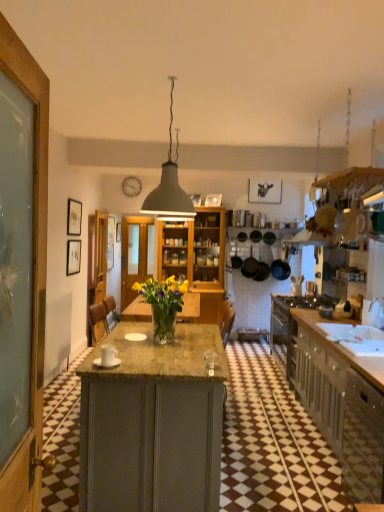
Question: Is wooden picture frame at center, arranged as the 1th picture frame when viewed from the back, inside the boundaries of matte gray lampshade at center, or outside?

Choices:
 (A) outside
 (B) inside

Answer: (A)

Question: Is wooden picture frame at center, the 3th picture frame viewed from the front, in front of or behind matte gray lampshade at center in the image?

Choices:
 (A) front
 (B) behind

Answer: (B)

Question: Which object is positioned farthest from the matte gray cabinetry at right?

Choices:
 (A) black cast iron pan at center, which is the first kitchen appliance from right to left
 (B) matte black frying pan at center, acting as the third kitchen appliance starting from the right
 (C) translucent glass vase at center
 (D) wooden picture frame at center, arranged as the 1th picture frame when viewed from the back
 (E) metallic wall clock at upper center

Answer: (E)

Question: Considering the real-world distances, which object is farthest from the translucent glass vase at center?

Choices:
 (A) matte gray cabinetry at right
 (B) matte black frying pan at center, arranged as the first kitchen appliance when viewed from the left
 (C) wooden picture frame at center, arranged as the 1th picture frame when viewed from the back
 (D) black cast iron pan at center, which is the first kitchen appliance from right to left
 (E) matte black picture frame at left, the second picture frame when ordered from front to back

Answer: (C)